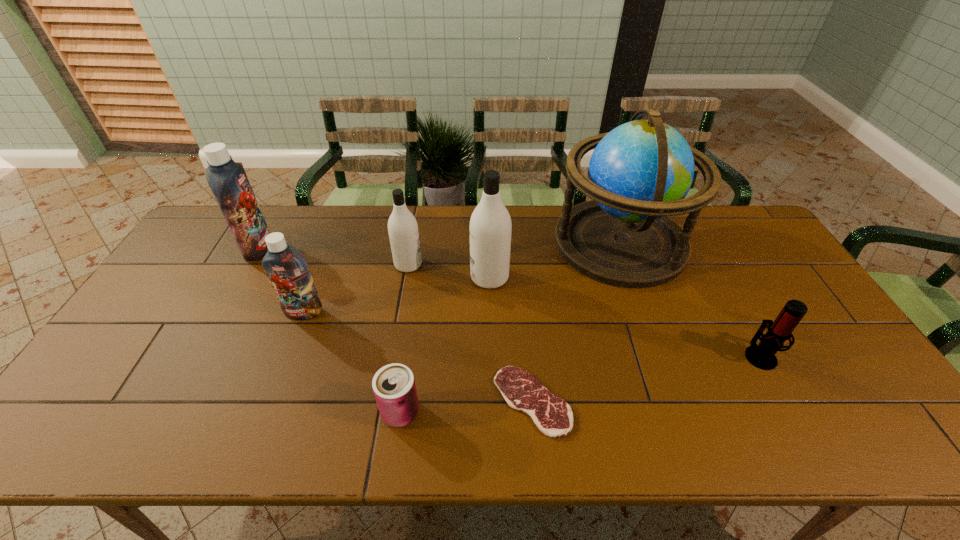
The width and height of the screenshot is (960, 540). Identify the location of free space between the steak and the sixth tallest object. [x=646, y=378].

The height and width of the screenshot is (540, 960). What are the coordinates of `vacant point located between the can and the fourth nearest object` in the screenshot? It's located at (352, 362).

Choose which object is the nearest neighbor to the tallest object. Please provide its 2D coordinates. Your answer should be formatted as a tuple, i.e. [(x, y)], where the tuple contains the x and y coordinates of a point satisfying the conditions above.

[(490, 226)]

Identify the location of the fifth closest object to the left white shampoo. The height and width of the screenshot is (540, 960). (394, 387).

The height and width of the screenshot is (540, 960). Find the location of `shampoo that is the closest to the leftmost shampoo`. shampoo that is the closest to the leftmost shampoo is located at coordinates (288, 273).

Where is `shampoo that is the third closest to the smaller white shampoo`? The height and width of the screenshot is (540, 960). shampoo that is the third closest to the smaller white shampoo is located at coordinates (228, 181).

You are a GUI agent. You are given a task and a screenshot of the screen. Output one action in this format:
    pyautogui.click(x=<x>, y=<y>)
    Task: Click on the free space that satisfies the following two spatial constraints: 1. on the front label of the nearest shampoo; 2. on the right side of the second shortest object
    The image size is (960, 540).
    Given the screenshot: What is the action you would take?
    pyautogui.click(x=265, y=412)

What are the coordinates of `vacant area in the image that satisfies the following two spatial constraints: 1. on the front-facing side of the red microphone; 2. on the right side of the right white shampoo` in the screenshot? It's located at (492, 355).

Image resolution: width=960 pixels, height=540 pixels. I want to click on free space that satisfies the following two spatial constraints: 1. on the front label of the right blue shampoo; 2. on the right side of the shortest object, so click(270, 401).

Where is `free region that satisfies the following two spatial constraints: 1. on the front-facing side of the bigger white shampoo; 2. on the front label of the smaller blue shampoo`? This screenshot has width=960, height=540. free region that satisfies the following two spatial constraints: 1. on the front-facing side of the bigger white shampoo; 2. on the front label of the smaller blue shampoo is located at coordinates (491, 312).